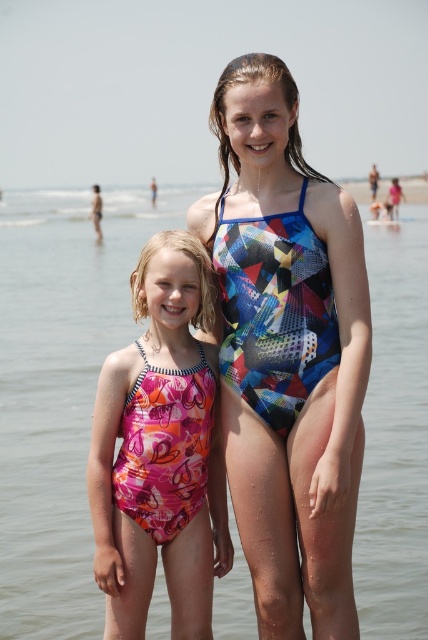
Which of these two, pink fabric swimsuit at center or multicolored geometric swimsuit at center, stands taller?

pink fabric swimsuit at center

Measure the distance between pink fabric swimsuit at center and camera.

pink fabric swimsuit at center is 17.50 meters from camera.

Where is `pink fabric swimsuit at center`? The width and height of the screenshot is (428, 640). pink fabric swimsuit at center is located at coordinates (59, 388).

Does multicolored geometric swimsuit at center have a lesser height compared to beige sand at lower right?

Correct, multicolored geometric swimsuit at center is not as tall as beige sand at lower right.

Between multicolored geometric swimsuit at center and beige sand at lower right, which one has less height?

multicolored geometric swimsuit at center is shorter.

Where is `multicolored geometric swimsuit at center`? multicolored geometric swimsuit at center is located at coordinates (288, 353).

Find the location of a particular element. This screenshot has width=428, height=640. multicolored geometric swimsuit at center is located at coordinates (288, 353).

Identify the location of multicolored geometric swimsuit at center. (288, 353).

In order to click on multicolored geometric swimsuit at center in this screenshot , I will do pos(288,353).